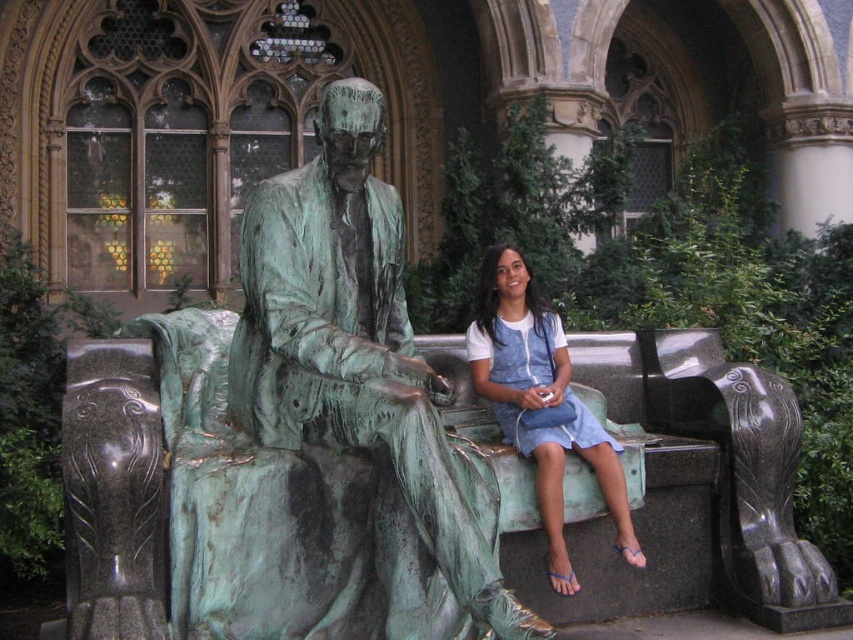
You are a visitor at the statue and want to take a photo of the denim dress at center without the green patina bronze statue at center blocking it. Is this possible?

The green patina bronze statue at center is positioned over denim dress at center, so the statue is blocking the view of the denim dress at center. Therefore, it is not possible to take a photo of the denim dress at center without the statue blocking it.

You are standing in front of the bronze statue and want to place a small flower at the point closest to you between point (457, 486) and point (514, 262). Which point should you choose?

Point (457, 486) is in front of point (514, 262), so you should choose point (457, 486) to place the flower as it is closer to you.